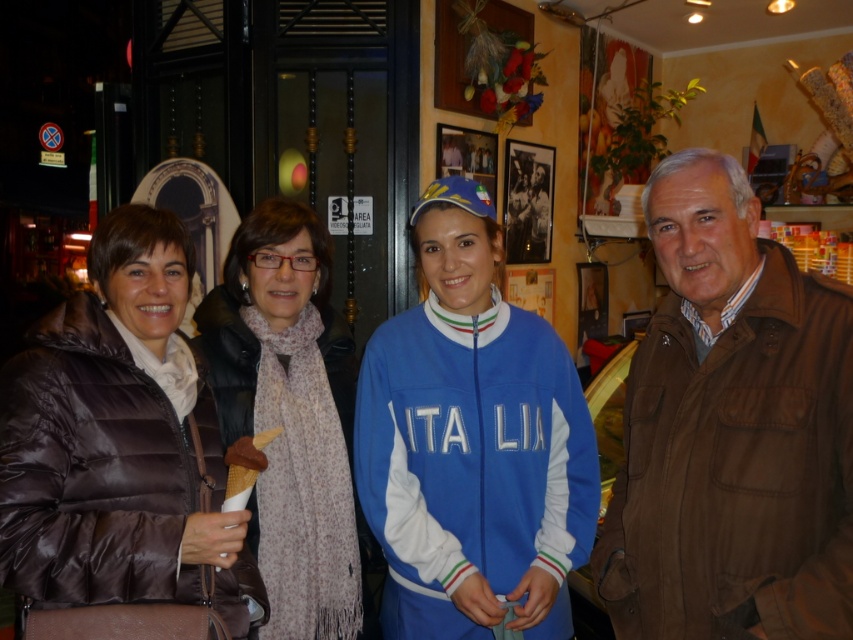
You are a photographer trying to capture a group photo of the brown quilted jacket at left and the light brown scarf at center. Since you want to ensure both subjects are fully visible, which subject requires a wider framing in your camera viewfinder?

The brown quilted jacket at left requires a wider framing in the camera viewfinder because its width surpasses that of the light brown scarf at center.

You are a photographer trying to capture both the brown quilted jacket at center and the light brown scarf at center in a single frame. Which object should you focus on first to ensure both are in the shot?

The brown quilted jacket at center is not as tall as light brown scarf at center, so you should focus on the taller light brown scarf at center first to ensure both are in the shot.

You are organizing a clothing donation drive and need to categorize items based on their size. You have two items to sort out, the brown quilted jacket at left and the light brown scarf at center. Which item is smaller in size?

The brown quilted jacket at left is smaller in size compared to the light brown scarf at center according to the description.